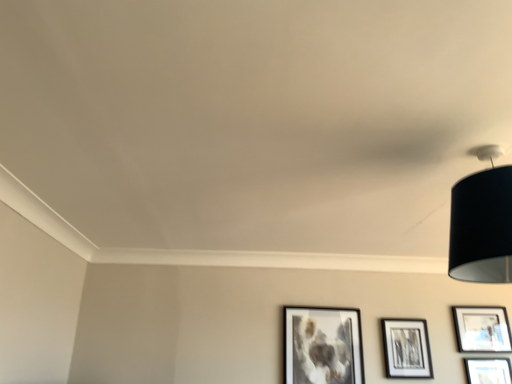
You are a GUI agent. You are given a task and a screenshot of the screen. Output one action in this format:
    pyautogui.click(x=<x>, y=<y>)
    Task: Click on the matte black picture frame at lower right, the third picture frame viewed from the left
    The width and height of the screenshot is (512, 384).
    Given the screenshot: What is the action you would take?
    pyautogui.click(x=488, y=370)

Identify the location of matte black picture frame at center right, placed as the 2th picture frame when sorted from left to right. The height and width of the screenshot is (384, 512). (406, 348).

The height and width of the screenshot is (384, 512). What do you see at coordinates (482, 223) in the screenshot?
I see `black fabric lampshade at upper right` at bounding box center [482, 223].

At what (x,y) coordinates should I click in order to perform the action: click on matte black picture frame at lower right, the third picture frame viewed from the left. Please return your answer as a coordinate pair (x, y). The image size is (512, 384). Looking at the image, I should click on (488, 370).

From the image's perspective, would you say matte black picture frame at lower right, the third picture frame viewed from the left, is shown under black fabric lampshade at upper right?

Yes, from the image's perspective, matte black picture frame at lower right, the third picture frame viewed from the left, is below black fabric lampshade at upper right.

Are matte black picture frame at lower right, the third picture frame viewed from the left, and black fabric lampshade at upper right making contact?

matte black picture frame at lower right, the third picture frame viewed from the left, and black fabric lampshade at upper right are not in contact.

Could you tell me if matte black picture frame at lower right, positioned as the 2th picture frame in right-to-left order, is turned towards black fabric lampshade at upper right?

Yes, matte black picture frame at lower right, positioned as the 2th picture frame in right-to-left order, faces towards black fabric lampshade at upper right.

Locate an element on the screen. lamp above the matte black picture frame at lower center, which is counted as the 1th picture frame, starting from the left (from the image's perspective) is located at coordinates (482, 223).

Does black fabric lampshade at upper right contain matte black picture frame at lower center, which is counted as the 1th picture frame, starting from the left?

No, matte black picture frame at lower center, which is counted as the 1th picture frame, starting from the left, is located outside of black fabric lampshade at upper right.

Who is smaller, black fabric lampshade at upper right or matte black picture frame at lower center, placed as the fourth picture frame when sorted from right to left?

Smaller between the two is matte black picture frame at lower center, placed as the fourth picture frame when sorted from right to left.

Is black fabric lampshade at upper right taller than matte black picture frame at lower center, which is counted as the 1th picture frame, starting from the left?

No.

Identify the location of the 1st picture frame above when counting from the matte black picture frame at center right, which is the 3th picture frame in right-to-left order (from the image's perspective). The height and width of the screenshot is (384, 512). (324, 346).

Does matte black picture frame at lower center, which is counted as the 1th picture frame, starting from the left, appear on the right side of matte black picture frame at center right, which is the 3th picture frame in right-to-left order?

In fact, matte black picture frame at lower center, which is counted as the 1th picture frame, starting from the left, is to the left of matte black picture frame at center right, which is the 3th picture frame in right-to-left order.

Could you tell me if matte black picture frame at lower center, which is counted as the 1th picture frame, starting from the left, is facing matte black picture frame at center right, placed as the 2th picture frame when sorted from left to right?

No.

Does matte black picture frame at center right, which is the 3th picture frame in right-to-left order, have a lesser width compared to matte black picture frame at lower right, positioned as the 2th picture frame in right-to-left order?

No, matte black picture frame at center right, which is the 3th picture frame in right-to-left order, is not thinner than matte black picture frame at lower right, positioned as the 2th picture frame in right-to-left order.

Is point (407, 353) positioned in front of point (489, 365)?

No, it is behind (489, 365).

What's the angular difference between matte black picture frame at center right, placed as the 2th picture frame when sorted from left to right, and matte black picture frame at lower right, the third picture frame viewed from the left,'s facing directions?

The angle between the facing direction of matte black picture frame at center right, placed as the 2th picture frame when sorted from left to right, and the facing direction of matte black picture frame at lower right, the third picture frame viewed from the left, is 0.00455 degrees.

Is matte black picture frame at center right, placed as the 2th picture frame when sorted from left to right, oriented towards matte black picture frame at lower right, the third picture frame viewed from the left?

No, matte black picture frame at center right, placed as the 2th picture frame when sorted from left to right, is not facing towards matte black picture frame at lower right, the third picture frame viewed from the left.

From the image's perspective, which is below, black fabric lampshade at upper right or matte black picture frame at center right, placed as the 2th picture frame when sorted from left to right?

matte black picture frame at center right, placed as the 2th picture frame when sorted from left to right, is shown below in the image.

Which point is more forward, (457, 265) or (402, 339)?

The point (457, 265) is in front.

Is matte black picture frame at center right, which is the 3th picture frame in right-to-left order, at the back of black fabric lampshade at upper right?

Correct, black fabric lampshade at upper right is looking away from matte black picture frame at center right, which is the 3th picture frame in right-to-left order.

From a real-world perspective, between black fabric lampshade at upper right and matte black picture frame at center right, which is the 3th picture frame in right-to-left order, who is vertically higher?

From a 3D spatial view, black fabric lampshade at upper right is above.

Can you confirm if matte black picture frame at lower center, placed as the fourth picture frame when sorted from right to left, is positioned to the right of matte black picture frame at lower right, the third picture frame viewed from the left?

Incorrect, matte black picture frame at lower center, placed as the fourth picture frame when sorted from right to left, is not on the right side of matte black picture frame at lower right, the third picture frame viewed from the left.

Is matte black picture frame at lower center, which is counted as the 1th picture frame, starting from the left, turned away from matte black picture frame at lower right, positioned as the 2th picture frame in right-to-left order?

matte black picture frame at lower center, which is counted as the 1th picture frame, starting from the left, does not have its back to matte black picture frame at lower right, positioned as the 2th picture frame in right-to-left order.

Is matte black picture frame at lower center, which is counted as the 1th picture frame, starting from the left, inside the boundaries of matte black picture frame at lower right, the third picture frame viewed from the left, or outside?

The correct answer is: outside.

From a real-world perspective, is matte black picture frame at lower center, placed as the fourth picture frame when sorted from right to left, on top of matte black picture frame at lower right, the third picture frame viewed from the left?

Yes, from a real-world perspective, matte black picture frame at lower center, placed as the fourth picture frame when sorted from right to left, is on top of matte black picture frame at lower right, the third picture frame viewed from the left.

Locate an element on the screen. Image resolution: width=512 pixels, height=384 pixels. the 3rd picture frame to the right when counting from the matte black picture frame at lower center, which is counted as the 1th picture frame, starting from the left is located at coordinates (482, 329).

Is matte black picture frame at lower center, which is counted as the 1th picture frame, starting from the left, not within matte black picture frame at lower right, arranged as the fourth picture frame when viewed from the left?

That's correct, matte black picture frame at lower center, which is counted as the 1th picture frame, starting from the left, is outside of matte black picture frame at lower right, arranged as the fourth picture frame when viewed from the left.

In the scene shown: Is matte black picture frame at lower center, which is counted as the 1th picture frame, starting from the left, facing away from matte black picture frame at lower right, which is the 1th picture frame in right-to-left order?

matte black picture frame at lower center, which is counted as the 1th picture frame, starting from the left, does not have its back to matte black picture frame at lower right, which is the 1th picture frame in right-to-left order.

Can you tell me how much matte black picture frame at lower center, placed as the fourth picture frame when sorted from right to left, and matte black picture frame at lower right, arranged as the fourth picture frame when viewed from the left, differ in facing direction?

The angular difference between matte black picture frame at lower center, placed as the fourth picture frame when sorted from right to left, and matte black picture frame at lower right, arranged as the fourth picture frame when viewed from the left, is 1.67 degrees.

You are a GUI agent. You are given a task and a screenshot of the screen. Output one action in this format:
    pyautogui.click(x=<x>, y=<y>)
    Task: Click on the 4th picture frame below the black fabric lampshade at upper right (from the image's perspective)
    The height and width of the screenshot is (384, 512).
    Given the screenshot: What is the action you would take?
    pyautogui.click(x=488, y=370)

Where is `the 2nd picture frame behind the black fabric lampshade at upper right`? This screenshot has height=384, width=512. the 2nd picture frame behind the black fabric lampshade at upper right is located at coordinates (324, 346).

Based on their spatial positions, is matte black picture frame at center right, which is the 3th picture frame in right-to-left order, or black fabric lampshade at upper right further from matte black picture frame at lower center, which is counted as the 1th picture frame, starting from the left?

black fabric lampshade at upper right.

Considering their positions, is matte black picture frame at lower right, the third picture frame viewed from the left, positioned closer to black fabric lampshade at upper right than matte black picture frame at center right, which is the 3th picture frame in right-to-left order?

matte black picture frame at center right, which is the 3th picture frame in right-to-left order.

Considering their positions, is matte black picture frame at lower right, which is the 1th picture frame in right-to-left order, positioned closer to matte black picture frame at lower center, which is counted as the 1th picture frame, starting from the left, than matte black picture frame at center right, placed as the 2th picture frame when sorted from left to right?

matte black picture frame at center right, placed as the 2th picture frame when sorted from left to right, is closer to matte black picture frame at lower center, which is counted as the 1th picture frame, starting from the left.

When comparing their distances from matte black picture frame at lower right, positioned as the 2th picture frame in right-to-left order, does matte black picture frame at lower right, which is the 1th picture frame in right-to-left order, or matte black picture frame at center right, placed as the 2th picture frame when sorted from left to right, seem closer?

matte black picture frame at lower right, which is the 1th picture frame in right-to-left order.

When comparing their distances from matte black picture frame at lower center, placed as the fourth picture frame when sorted from right to left, does matte black picture frame at lower right, positioned as the 2th picture frame in right-to-left order, or matte black picture frame at center right, placed as the 2th picture frame when sorted from left to right, seem further?

matte black picture frame at lower right, positioned as the 2th picture frame in right-to-left order.

Considering their positions, is matte black picture frame at lower center, placed as the fourth picture frame when sorted from right to left, positioned closer to matte black picture frame at lower right, the third picture frame viewed from the left, than matte black picture frame at lower right, which is the 1th picture frame in right-to-left order?

matte black picture frame at lower right, which is the 1th picture frame in right-to-left order, lies closer to matte black picture frame at lower right, the third picture frame viewed from the left, than the other object.

Based on their spatial positions, is matte black picture frame at lower right, the third picture frame viewed from the left, or matte black picture frame at lower right, which is the 1th picture frame in right-to-left order, further from black fabric lampshade at upper right?

The object further to black fabric lampshade at upper right is matte black picture frame at lower right, the third picture frame viewed from the left.

From the picture: Looking at the image, which one is located further to matte black picture frame at lower right, which is the 1th picture frame in right-to-left order, matte black picture frame at lower right, the third picture frame viewed from the left, or matte black picture frame at lower center, which is counted as the 1th picture frame, starting from the left?

matte black picture frame at lower center, which is counted as the 1th picture frame, starting from the left.

Identify the location of picture frame between black fabric lampshade at upper right and matte black picture frame at lower center, placed as the fourth picture frame when sorted from right to left, from front to back. The image size is (512, 384). tap(488, 370).

In order to click on picture frame between matte black picture frame at lower center, placed as the fourth picture frame when sorted from right to left, and matte black picture frame at lower right, the third picture frame viewed from the left, from left to right in this screenshot , I will do `click(406, 348)`.

Locate an element on the screen. This screenshot has height=384, width=512. picture frame between matte black picture frame at center right, which is the 3th picture frame in right-to-left order, and matte black picture frame at lower right, which is the 1th picture frame in right-to-left order, in the horizontal direction is located at coordinates (488, 370).